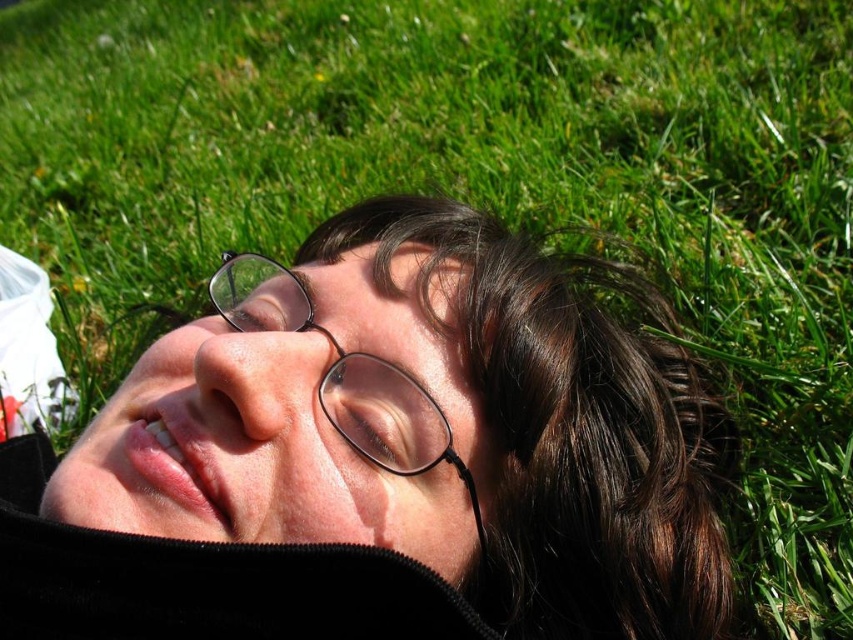
You are a photographer trying to capture a close up of the person in the scene. You want to focus on both the matte black glasses at center and the clear plastic glasses at center. Given that your camera can only focus on objects within a 10 cm range, will you be able to capture both glasses in focus?

The matte black glasses at center and clear plastic glasses at center are 9.74 centimeters apart from each other, which is within the 10 cm range. Therefore, the camera can focus on both glasses simultaneously.

You are a photographer trying to capture the exact position of the person in the image. You know the glasses are at point [432,426]. Where should you focus your camera to ensure the glasses are centered in the photo?

The matte black glasses at center are located at point [432,426], so you should focus your camera on that coordinate to center them in the photo.

You are a photographer adjusting the position of two pairs of glasses on a table. The scene shows the matte black glasses at center and the clear plastic glasses at center. Which pair is positioned to the right of the other?

The matte black glasses at center are positioned to the right of the clear plastic glasses at center.